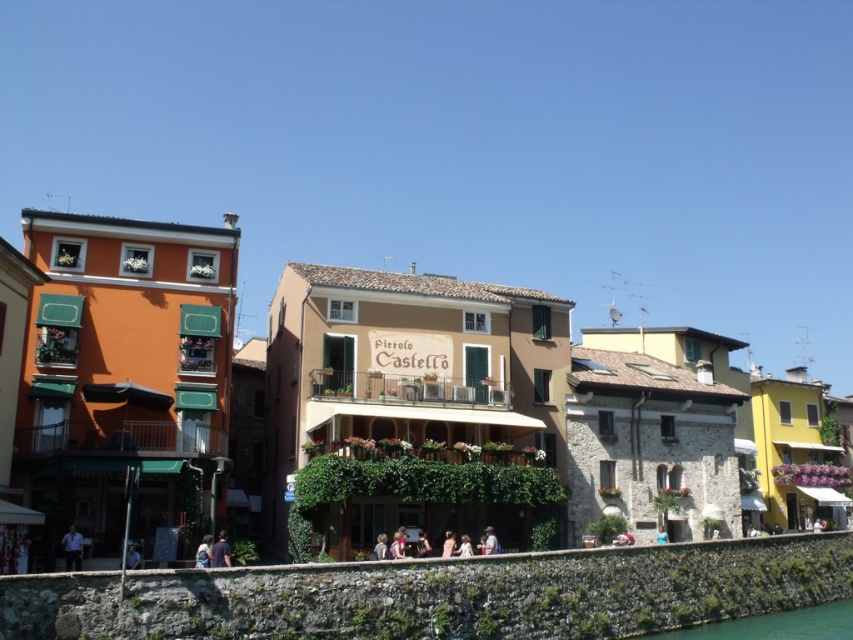
You are a tourist visiting the riverside town and want to take a photo of the matte orange building at center and the light blue fabric shirt at lower left. Which object should you focus on first if you want to capture both in a single frame without moving the camera?

The matte orange building at center is larger than the light blue fabric shirt at lower left, so you should focus on the matte orange building at center first to ensure it fills the frame appropriately before adjusting for the smaller object.

You are standing in the riverside town and want to take a photo that includes both the orange building with green awnings and the Pierolo Castello. The orange building is located at point [160,296] and the Pierolo Castello is at point [73,524]. Which building should you position closer to the camera to ensure both are in focus?

You should position the orange building with green awnings at point [160,296] closer to the camera because it is already further away than the Pierolo Castello at point [73,524]. This will help both buildings be in focus as they will be at a similar distance from the camera.